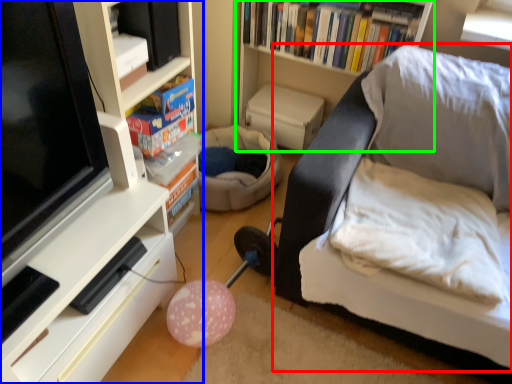
Question: Based on their relative distances, which object is farther from studio couch (highlighted by a red box)? Choose from shelf (highlighted by a blue box) and bookshelf (highlighted by a green box).

Choices:
 (A) shelf
 (B) bookshelf

Answer: (A)